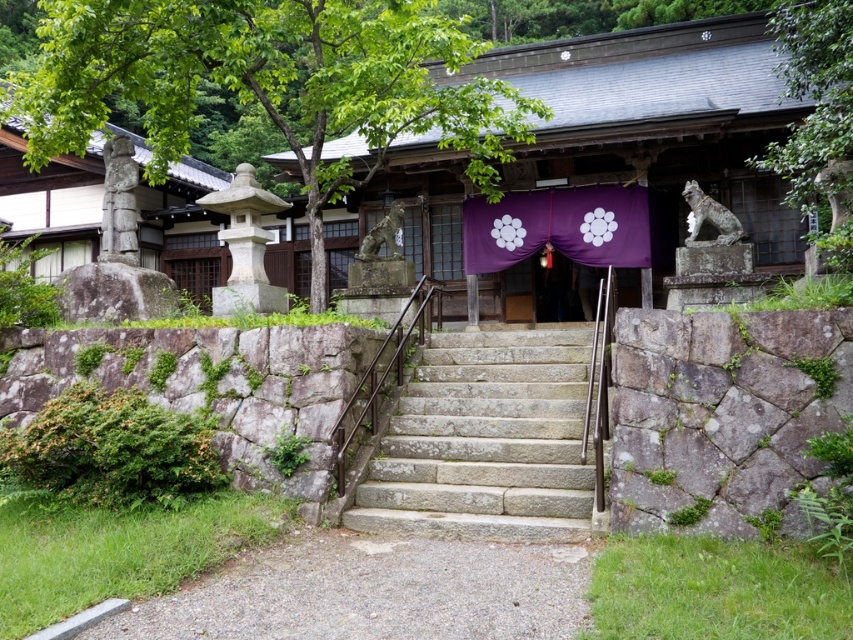
You are a visitor at the shrine and want to place a 4 meter long wooden bench between the green leafy tree at left and the purple satin curtain at center. Will the bench fit without overlapping either object?

The distance between the green leafy tree at left and the purple satin curtain at center is 3.98 meters. Since the bench is 4 meters long, it will not fit as it is slightly longer than the available space between them.

You are standing at the entrance of the traditional Japanese building and looking towards the upper right corner of the image. There is a point marked at coordinates (817,115). What object is located at that point?

The point at coordinates (817,115) marks a green leafy tree at the upper right corner of the image.

You are standing at the bottom of the stone steps leading to the shrine entrance. You see two points marked on the ground ahead of you. The first point is at coordinate point(149,64) and the second point is at coordinate point(602,196). Which point is closer to you as you face the shrine?

Point(149,64) is in front of point(602,196), so it is closer to you as you face the shrine.